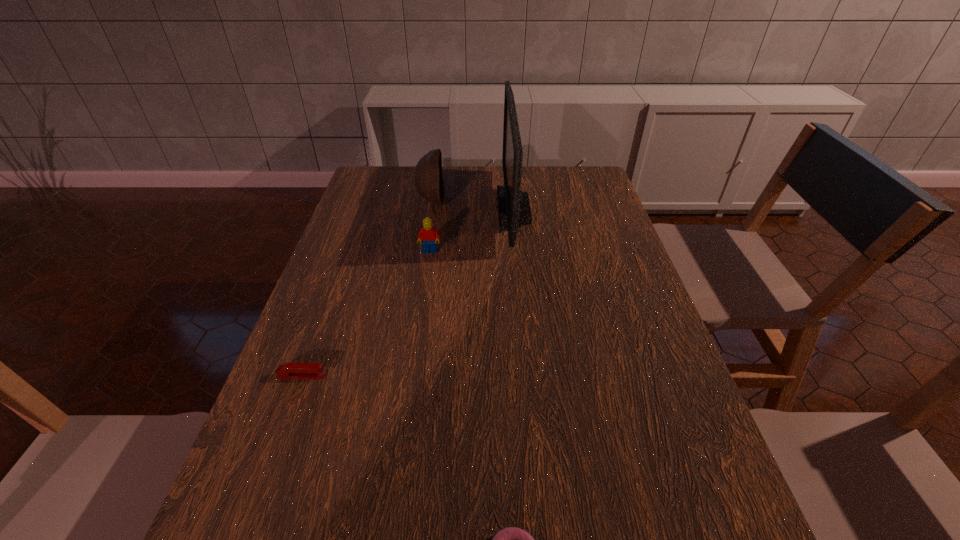
The image size is (960, 540). What are the coordinates of `free spot located on the front-facing side of the stapler` in the screenshot? It's located at (429, 376).

Image resolution: width=960 pixels, height=540 pixels. Find the location of `monitor that is at the far edge`. monitor that is at the far edge is located at coordinates (514, 211).

At what (x,y) coordinates should I click in order to perform the action: click on bowl situated at the far edge. Please return your answer as a coordinate pair (x, y). The width and height of the screenshot is (960, 540). Looking at the image, I should click on tap(429, 182).

Find the location of `object that is at the left edge`. object that is at the left edge is located at coordinates (287, 370).

The height and width of the screenshot is (540, 960). I want to click on free space at the far edge of the desktop, so pyautogui.click(x=476, y=187).

In the image, there is a desktop. At what (x,y) coordinates should I click in order to perform the action: click on vacant space at the left edge. Please return your answer as a coordinate pair (x, y). The image size is (960, 540). Looking at the image, I should click on (318, 300).

Find the location of a particular element. The height and width of the screenshot is (540, 960). vacant area at the right edge of the desktop is located at coordinates (609, 380).

In order to click on free space at the far right corner of the desktop in this screenshot , I will do `click(597, 180)`.

At what (x,y) coordinates should I click in order to perform the action: click on unoccupied position between the tallest object and the stapler. Please return your answer as a coordinate pair (x, y). The width and height of the screenshot is (960, 540). Looking at the image, I should click on click(408, 293).

At what (x,y) coordinates should I click in order to perform the action: click on free space between the bowl and the leftmost object. Please return your answer as a coordinate pair (x, y). The height and width of the screenshot is (540, 960). Looking at the image, I should click on (367, 288).